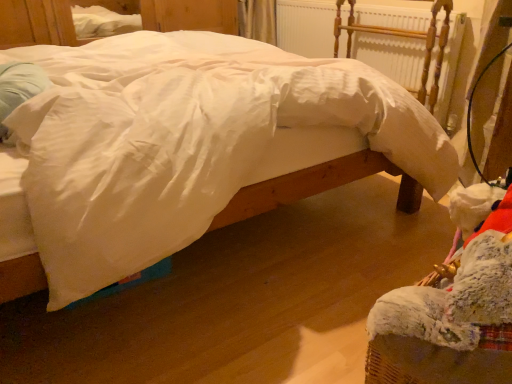
Question: From the image's perspective, is white soft pillow at left above or below white painted wood radiator at upper center?

Choices:
 (A) below
 (B) above

Answer: (A)

Question: Looking at the image, does white soft pillow at left seem bigger or smaller compared to white painted wood radiator at upper center?

Choices:
 (A) big
 (B) small

Answer: (B)

Question: Considering the real-world distances, which object is closest to the white painted wood radiator at upper center?

Choices:
 (A) white soft pillow at left
 (B) white smooth bed at center

Answer: (B)

Question: Which is farther from the white painted wood radiator at upper center?

Choices:
 (A) white soft pillow at left
 (B) white smooth bed at center

Answer: (A)